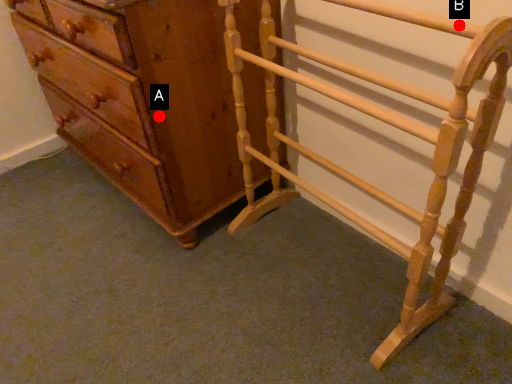
Question: Two points are circled on the image, labeled by A and B beside each circle. Which point is further to the camera?

Choices:
 (A) A is further
 (B) B is further

Answer: (A)